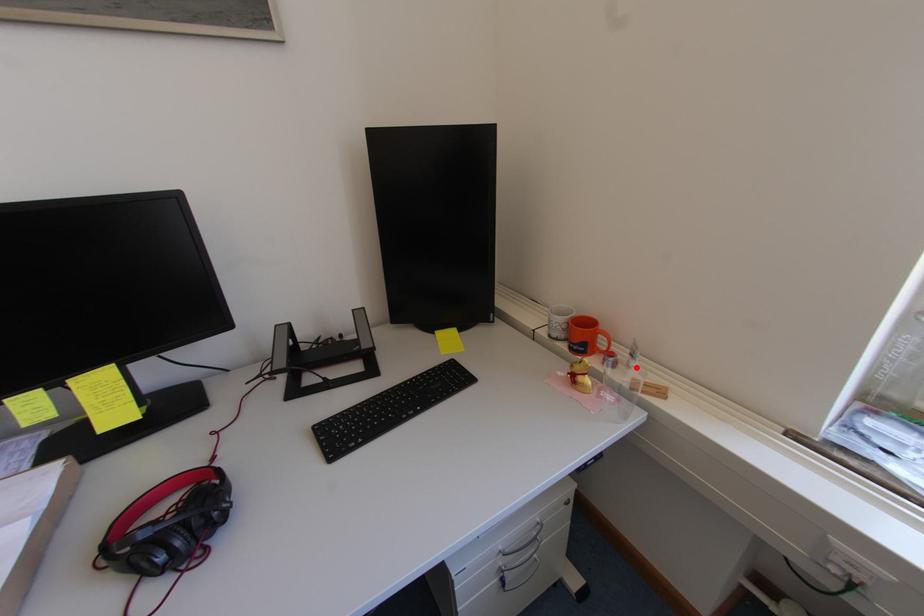
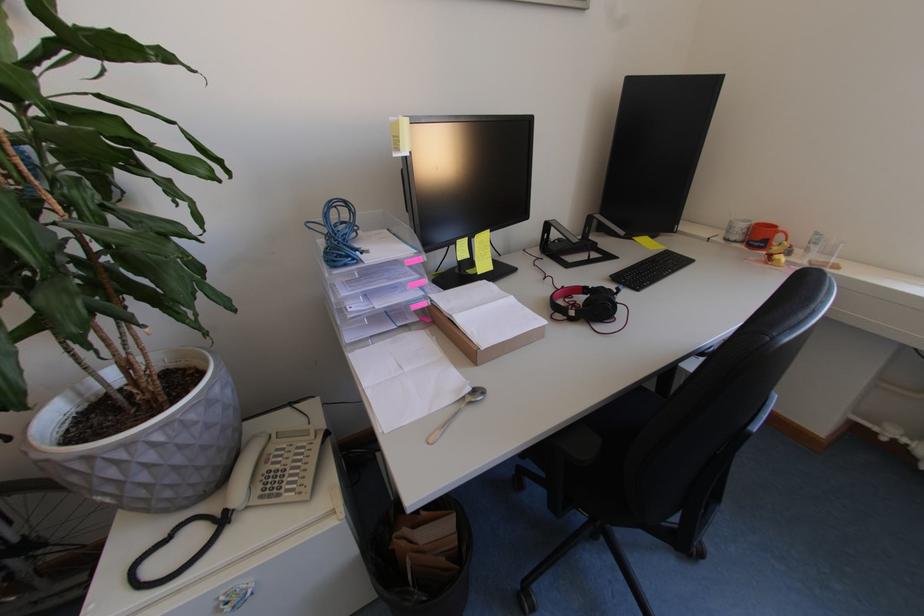
Locate, in the second image, the point that corresponds to the highlighted location in the first image.

(816, 253)